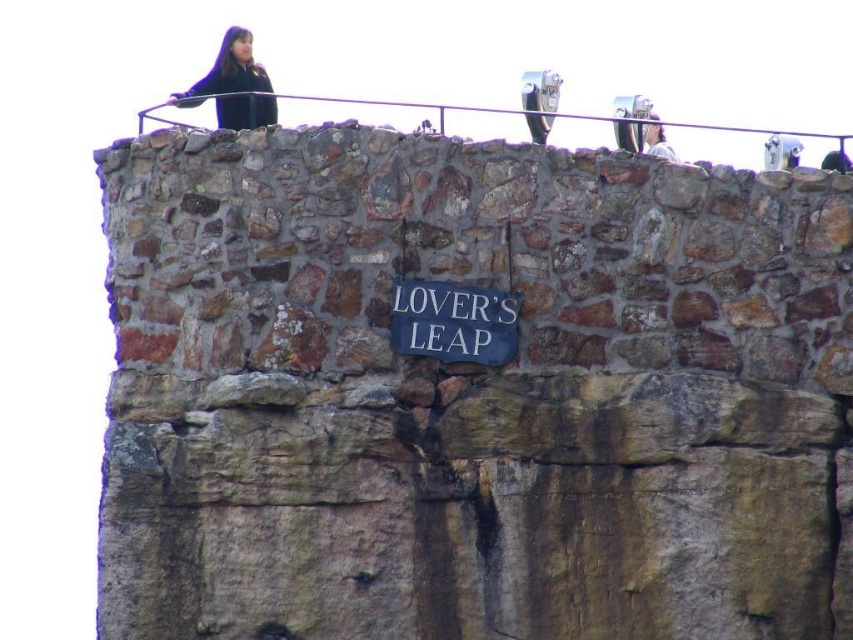
Does brown stone cliff at upper center appear over white painted wood sign at center?

Actually, brown stone cliff at upper center is below white painted wood sign at center.

Based on the photo, can you confirm if brown stone cliff at upper center is thinner than white painted wood sign at center?

No, brown stone cliff at upper center is not thinner than white painted wood sign at center.

Is point (247, 211) farther from camera compared to point (473, 317)?

That is True.

Where is `brown stone cliff at upper center`? The image size is (853, 640). brown stone cliff at upper center is located at coordinates (468, 394).

Does brown stone cliff at upper center have a lesser height compared to light brown hair at upper right?

No, brown stone cliff at upper center is not shorter than light brown hair at upper right.

Is brown stone cliff at upper center further to camera compared to light brown hair at upper right?

No, it is not.

Is point (813, 481) behind point (654, 140)?

No, (813, 481) is in front of (654, 140).

In order to click on brown stone cliff at upper center in this screenshot , I will do `click(468, 394)`.

Does matte black jacket at upper left have a smaller size compared to light brown hair at upper right?

No.

At what (x,y) coordinates should I click in order to perform the action: click on matte black jacket at upper left. Please return your answer as a coordinate pair (x, y). Looking at the image, I should click on (234, 84).